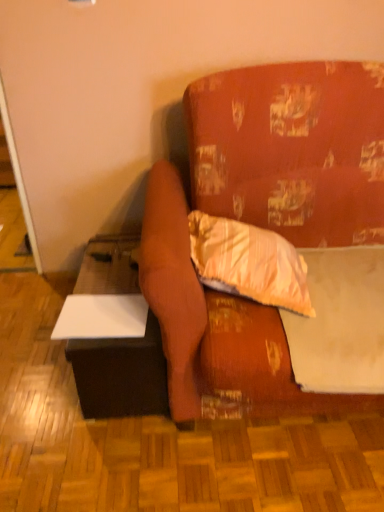
You are a GUI agent. You are given a task and a screenshot of the screen. Output one action in this format:
    pyautogui.click(x=<x>, y=<y>)
    Task: Click on the vacant space in front of white matte table at lower left
    Image resolution: width=384 pixels, height=512 pixels.
    Given the screenshot: What is the action you would take?
    pyautogui.click(x=122, y=456)